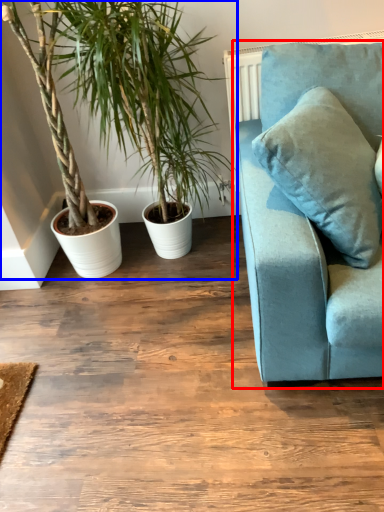
Question: Which point is closer to the camera, studio couch (highlighted by a red box) or houseplant (highlighted by a blue box)?

Choices:
 (A) studio couch
 (B) houseplant

Answer: (A)